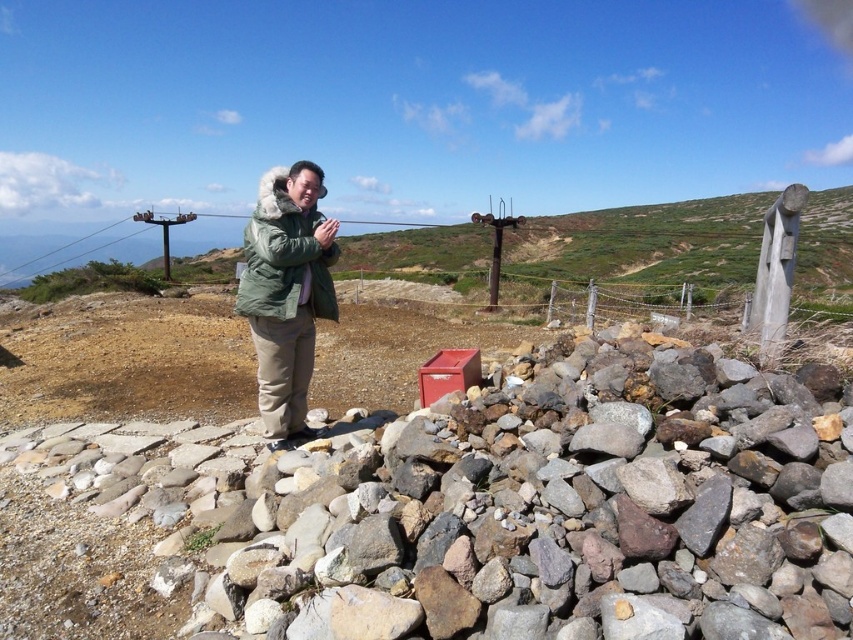
You are a photographer trying to capture both the green fuzzy coat at center and the red matte cooler at center in a single frame. Since you want both objects to be clearly visible, which object should you focus on first to ensure it appears sharp in the photo?

The green fuzzy coat at center is larger in size than the red matte cooler at center, so you should focus on the green fuzzy coat at center first to ensure it appears sharp in the photo.

You are a hiker who wants to place your water bottle on a stable surface. Which object between the smooth gray rock at center and the red matte cooler at center would be more suitable for placing your water bottle?

The smooth gray rock at center is located below the red matte cooler at center. Since the cooler is likely designed to have a flat surface for placing items, the red matte cooler at center would be more suitable for placing your water bottle.